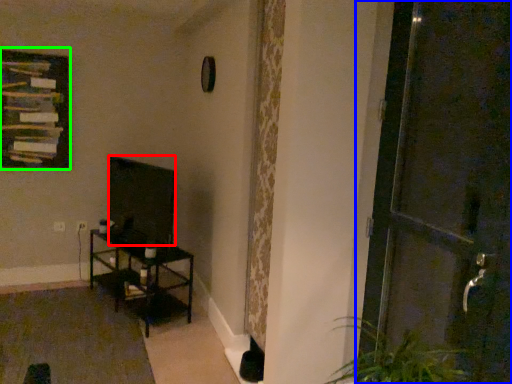
Question: Based on their relative distances, which object is farther from wide (highlighted by a red box)? Choose from door (highlighted by a blue box) and picture frame (highlighted by a green box).

Choices:
 (A) door
 (B) picture frame

Answer: (A)